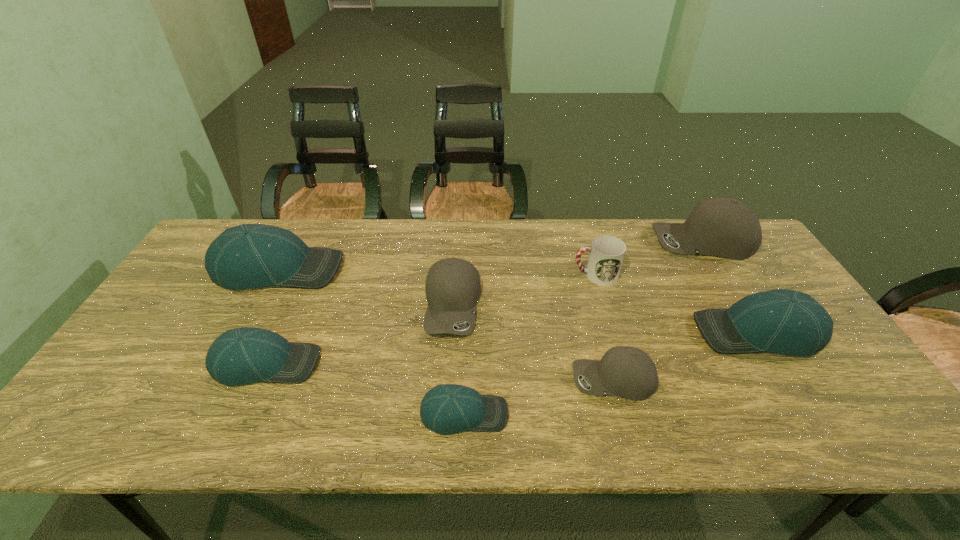
Locate an element on the screen. the second light baseball cap from right to left is located at coordinates (448, 408).

You are a GUI agent. You are given a task and a screenshot of the screen. Output one action in this format:
    pyautogui.click(x=<x>, y=<y>)
    Task: Click on the smallest light baseball cap
    
    Given the screenshot: What is the action you would take?
    pyautogui.click(x=448, y=408)

The image size is (960, 540). I want to click on free space located on the front brim of the farthest gray baseball cap, so click(547, 242).

Where is `vacant space situated 0.270m on the front brim of the farthest gray baseball cap`? Image resolution: width=960 pixels, height=540 pixels. vacant space situated 0.270m on the front brim of the farthest gray baseball cap is located at coordinates (572, 242).

Identify the location of free space located 0.290m on the front brim of the farthest gray baseball cap. The height and width of the screenshot is (540, 960). (565, 242).

The width and height of the screenshot is (960, 540). In order to click on vacant position located 0.150m on the back of the farthest light baseball cap in this screenshot , I will do `click(303, 221)`.

The height and width of the screenshot is (540, 960). Identify the location of vacant space located 0.190m on the front brim of the second farthest gray baseball cap. (x=446, y=406).

Find the location of a particular element. vacant space located on the back of the rightmost light baseball cap is located at coordinates (706, 248).

Where is `free space located on the handle side of the red cup`? Image resolution: width=960 pixels, height=540 pixels. free space located on the handle side of the red cup is located at coordinates (473, 275).

Identify the location of vacant space located on the handle side of the red cup. This screenshot has width=960, height=540. (473, 275).